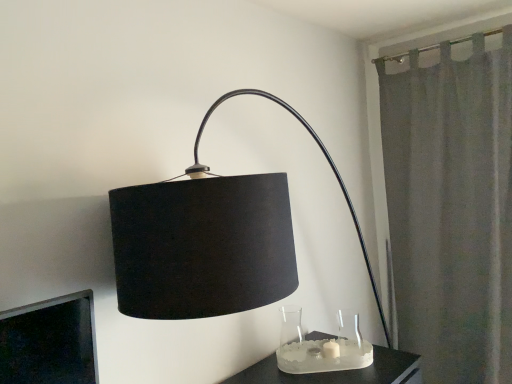
Question: Is satin glass candle holder at lower center next to gray fabric curtain at right?

Choices:
 (A) no
 (B) yes

Answer: (A)

Question: Considering the relative sizes of satin glass candle holder at lower center and gray fabric curtain at right in the image provided, is satin glass candle holder at lower center thinner than gray fabric curtain at right?

Choices:
 (A) yes
 (B) no

Answer: (A)

Question: From the image's perspective, would you say satin glass candle holder at lower center is positioned over gray fabric curtain at right?

Choices:
 (A) yes
 (B) no

Answer: (B)

Question: Considering the relative sizes of satin glass candle holder at lower center and gray fabric curtain at right in the image provided, is satin glass candle holder at lower center bigger than gray fabric curtain at right?

Choices:
 (A) yes
 (B) no

Answer: (B)

Question: Is satin glass candle holder at lower center not inside gray fabric curtain at right?

Choices:
 (A) no
 (B) yes

Answer: (B)

Question: Does satin glass candle holder at lower center come in front of gray fabric curtain at right?

Choices:
 (A) no
 (B) yes

Answer: (B)

Question: Does satin glass candle holder at lower center have a greater width compared to transparent glass vase at lower center, which is the 2th glass vase in left-to-right order?

Choices:
 (A) yes
 (B) no

Answer: (A)

Question: Does satin glass candle holder at lower center turn towards transparent glass vase at lower center, marked as the 1th glass vase in a right-to-left arrangement?

Choices:
 (A) no
 (B) yes

Answer: (A)

Question: From a real-world perspective, is satin glass candle holder at lower center on transparent glass vase at lower center, which is the 2th glass vase in left-to-right order?

Choices:
 (A) no
 (B) yes

Answer: (A)

Question: Considering the relative sizes of satin glass candle holder at lower center and transparent glass vase at lower center, which is the 2th glass vase in left-to-right order, in the image provided, is satin glass candle holder at lower center taller than transparent glass vase at lower center, which is the 2th glass vase in left-to-right order,?

Choices:
 (A) yes
 (B) no

Answer: (B)

Question: Is transparent glass vase at lower center, which is the 2th glass vase in left-to-right order, a part of satin glass candle holder at lower center?

Choices:
 (A) yes
 (B) no

Answer: (B)

Question: From the image's perspective, is satin glass candle holder at lower center located above transparent glass vase at lower center, marked as the 1th glass vase in a right-to-left arrangement?

Choices:
 (A) no
 (B) yes

Answer: (A)

Question: Can you confirm if clear glass vase at lower center, which is counted as the 1th glass vase, starting from the left, is shorter than gray fabric curtain at right?

Choices:
 (A) yes
 (B) no

Answer: (A)